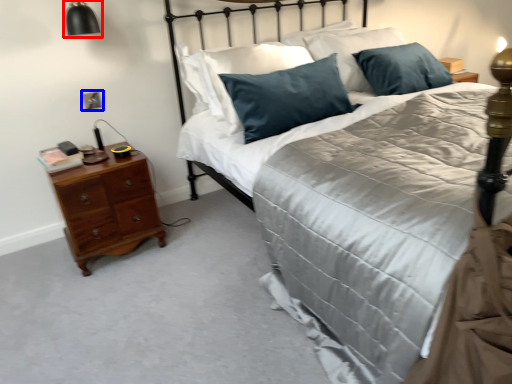
Question: Among these objects, which one is nearest to the camera, bedside lamp (highlighted by a red box) or electric outlet (highlighted by a blue box)?

Choices:
 (A) bedside lamp
 (B) electric outlet

Answer: (A)